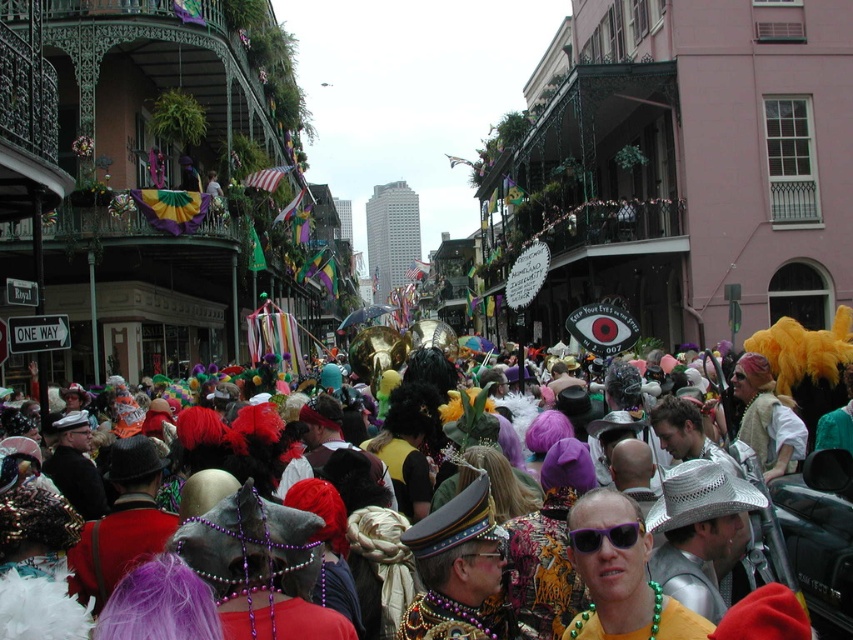
Does multicolored feathers at center lie behind purple plastic sunglasses at center?

That is False.

Is multicolored feathers at center to the left of purple plastic sunglasses at center from the viewer's perspective?

No, multicolored feathers at center is not to the left of purple plastic sunglasses at center.

Who is more forward, [834,456] or [608,529]?

Positioned in front is point [608,529].

The image size is (853, 640). I want to click on multicolored feathers at center, so click(811, 524).

Is shiny gold necklace at center bigger than purple plastic sunglasses at center?

Correct, shiny gold necklace at center is larger in size than purple plastic sunglasses at center.

Between shiny gold necklace at center and purple plastic sunglasses at center, which one appears on the left side from the viewer's perspective?

purple plastic sunglasses at center is more to the left.

Is point (634, 525) less distant than point (584, 552)?

No, (634, 525) is further to viewer.

What are the coordinates of `shiny gold necklace at center` in the screenshot? It's located at (621, 576).

Which is more to the right, multicolored feathers at center or shiny gold necklace at center?

Positioned to the right is multicolored feathers at center.

The image size is (853, 640). What do you see at coordinates (811, 524) in the screenshot?
I see `multicolored feathers at center` at bounding box center [811, 524].

Find the location of a particular element. multicolored feathers at center is located at coordinates (811, 524).